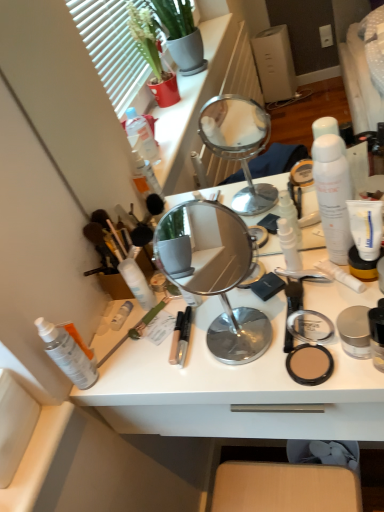
Question: Is white matte lotion at center, the 5th toiletry when ordered from left to right, taller than white matte tube at right, acting as the first toothpaste starting from the top?

Choices:
 (A) yes
 (B) no

Answer: (B)

Question: Does white matte lotion at center, acting as the 2th toiletry starting from the right, have a larger size compared to white matte tube at right, the second toothpaste ordered from the bottom?

Choices:
 (A) no
 (B) yes

Answer: (A)

Question: From a real-world perspective, is white matte lotion at center, acting as the 2th toiletry starting from the right, over white matte tube at right, the second toothpaste ordered from the bottom?

Choices:
 (A) yes
 (B) no

Answer: (B)

Question: Is white matte tube at right, acting as the first toothpaste starting from the top, a part of white matte lotion at center, the 5th toiletry when ordered from left to right?

Choices:
 (A) yes
 (B) no

Answer: (B)

Question: Is white matte lotion at center, the 5th toiletry when ordered from left to right, at the right side of white matte tube at right, acting as the first toothpaste starting from the top?

Choices:
 (A) yes
 (B) no

Answer: (B)

Question: From the image's perspective, is white matte lotion at center, the 5th toiletry when ordered from left to right, below white matte tube at right, the second toothpaste ordered from the bottom?

Choices:
 (A) no
 (B) yes

Answer: (B)

Question: From a real-world perspective, is green matte brush at center over polished silver mirror at center?

Choices:
 (A) no
 (B) yes

Answer: (A)

Question: Does green matte brush at center have a lesser height compared to polished silver mirror at center?

Choices:
 (A) yes
 (B) no

Answer: (A)

Question: Is green matte brush at center far from polished silver mirror at center?

Choices:
 (A) yes
 (B) no

Answer: (A)

Question: From a real-world perspective, is green matte brush at center beneath polished silver mirror at center?

Choices:
 (A) yes
 (B) no

Answer: (A)

Question: Is green matte brush at center directly adjacent to polished silver mirror at center?

Choices:
 (A) no
 (B) yes

Answer: (A)

Question: Is green matte brush at center to the left of polished silver mirror at center from the viewer's perspective?

Choices:
 (A) no
 (B) yes

Answer: (B)

Question: Is white matte spray can at center, which is the fourth toiletry in left-to-right order, inside transparent plastic spray bottle at lower left, the 1th toiletry from the left?

Choices:
 (A) no
 (B) yes

Answer: (A)